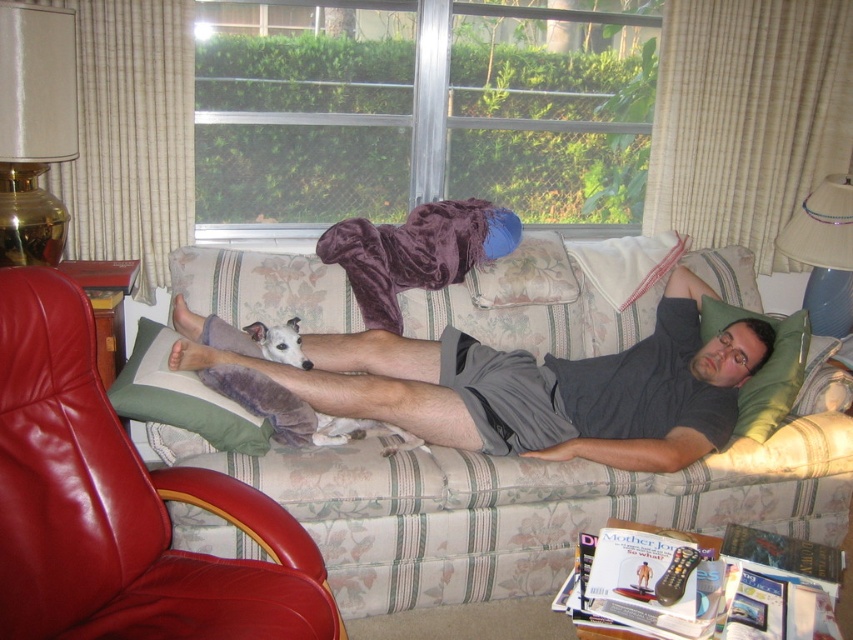
Is point (802, 420) closer to camera compared to point (142, 330)?

No, (802, 420) is further to viewer.

Is point (741, 451) farther from camera compared to point (154, 417)?

Yes, it is.

Identify the location of floral fabric couch at center. The width and height of the screenshot is (853, 640). (532, 500).

Between leather armchair at lower left and white fur dog at center, which one appears on the left side from the viewer's perspective?

From the viewer's perspective, leather armchair at lower left appears more on the left side.

Can you confirm if leather armchair at lower left is positioned above white fur dog at center?

Actually, leather armchair at lower left is below white fur dog at center.

Which is in front, point (62, 580) or point (277, 337)?

Point (62, 580) is more forward.

Locate an element on the screen. leather armchair at lower left is located at coordinates (120, 506).

Is floral fabric couch at center behind leather armchair at lower left?

Yes, it is behind leather armchair at lower left.

What are the coordinates of `floral fabric couch at center` in the screenshot? It's located at (532, 500).

Is point (355, 589) closer to camera compared to point (178, 468)?

No, (355, 589) is further to viewer.

This screenshot has width=853, height=640. What are the coordinates of `floral fabric couch at center` in the screenshot? It's located at (532, 500).